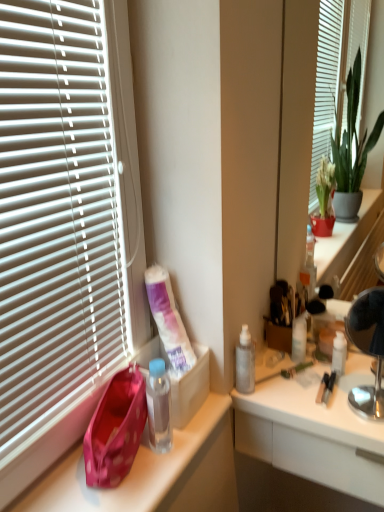
Identify the location of vacant space to the right of translucent plastic bottle at upper right. [342, 365].